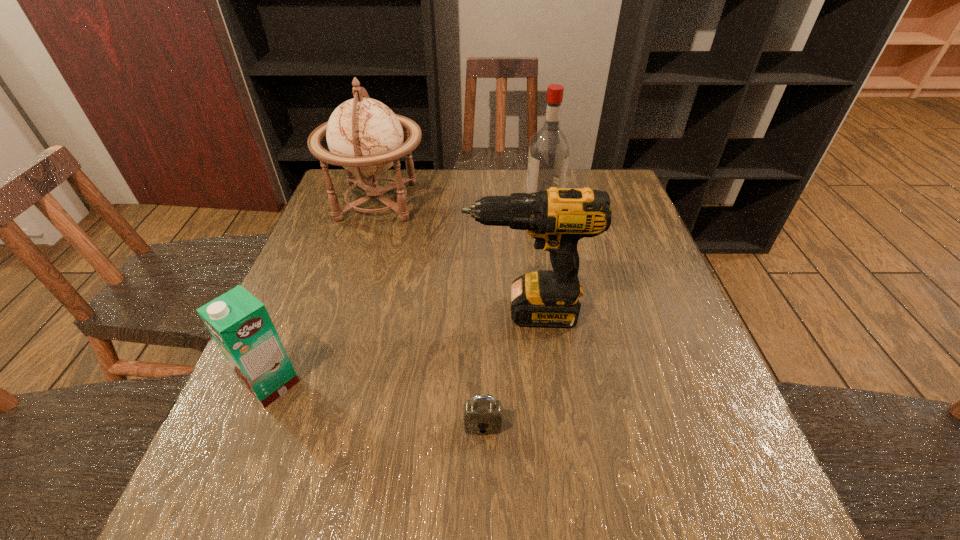
The height and width of the screenshot is (540, 960). I want to click on object that is at the far left corner, so click(364, 136).

I want to click on free region at the far edge of the desktop, so click(448, 196).

In the image, there is a desktop. Find the location of `vacant space at the near edge`. vacant space at the near edge is located at coordinates point(354,525).

This screenshot has height=540, width=960. I want to click on vacant area at the left edge of the desktop, so coord(324,224).

The width and height of the screenshot is (960, 540). I want to click on vacant region at the right edge of the desktop, so click(609, 252).

You are a GUI agent. You are given a task and a screenshot of the screen. Output one action in this format:
    pyautogui.click(x=<x>, y=<y>)
    Task: Click on the vacant space at the far left corner of the desktop
    This screenshot has width=960, height=540.
    Given the screenshot: What is the action you would take?
    pyautogui.click(x=380, y=202)

Locate an element on the screen. vacant space at the near right corner is located at coordinates (696, 529).

I want to click on free space between the third farthest object and the liquor, so click(x=535, y=256).

The width and height of the screenshot is (960, 540). I want to click on unoccupied position between the nearest object and the globe, so click(430, 313).

Image resolution: width=960 pixels, height=540 pixels. I want to click on vacant point located between the nearest object and the globe, so click(x=430, y=313).